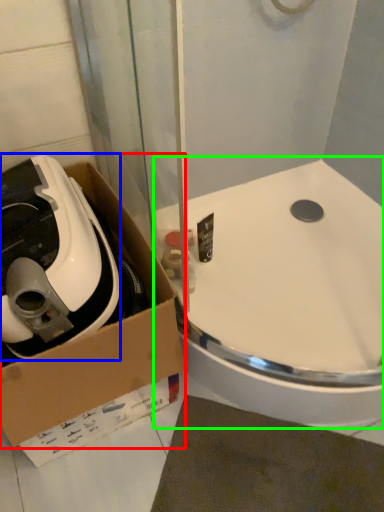
Question: Which object is positioned closest to box (highlighted by a red box)? Select from appliance (highlighted by a blue box) and sink (highlighted by a green box).

Choices:
 (A) appliance
 (B) sink

Answer: (A)